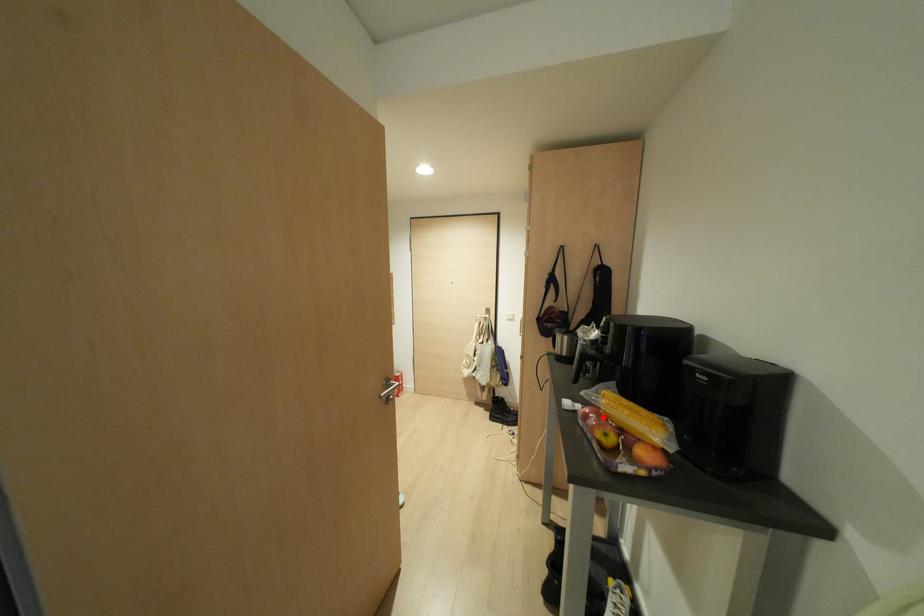
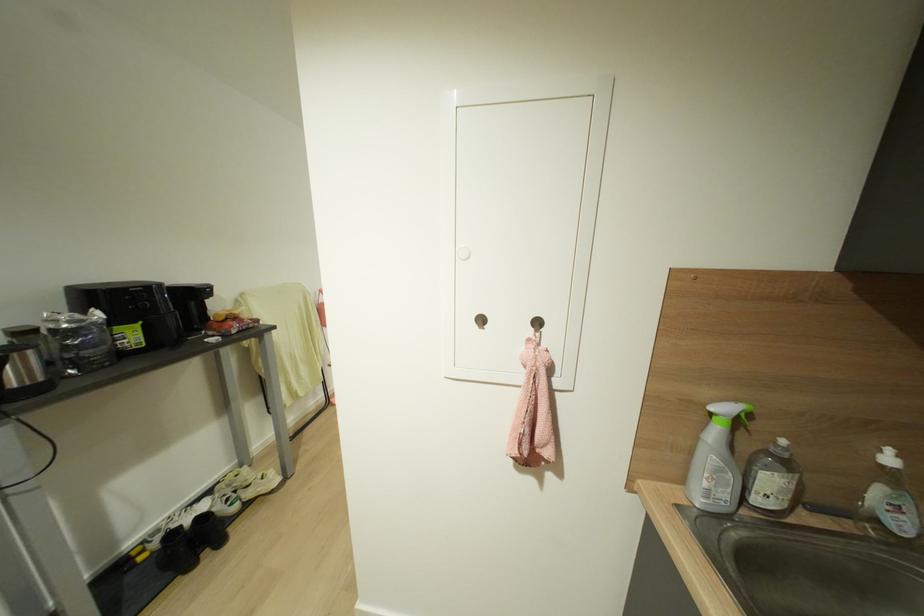
Question: I am providing you with two images of the same scene from different viewpoints. A red point is marked on the first image. Is the red point's position out of view in image 2?

Choices:
 (A) Yes
 (B) No

Answer: (A)